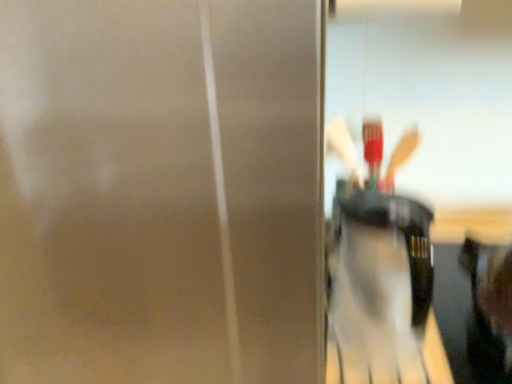
Question: From the image's perspective, would you say smooth black hair at right is shown under translucent plastic cup at center?

Choices:
 (A) yes
 (B) no

Answer: (B)

Question: Is smooth black hair at right closer to the viewer compared to translucent plastic cup at center?

Choices:
 (A) yes
 (B) no

Answer: (A)

Question: From a real-world perspective, is smooth black hair at right under translucent plastic cup at center?

Choices:
 (A) no
 (B) yes

Answer: (A)

Question: Is smooth black hair at right thinner than translucent plastic cup at center?

Choices:
 (A) no
 (B) yes

Answer: (A)

Question: Is smooth black hair at right oriented towards translucent plastic cup at center?

Choices:
 (A) no
 (B) yes

Answer: (A)

Question: Considering the relative sizes of smooth black hair at right and translucent plastic cup at center in the image provided, is smooth black hair at right shorter than translucent plastic cup at center?

Choices:
 (A) yes
 (B) no

Answer: (B)

Question: Can you confirm if translucent plastic cup at center is thinner than smooth black hair at right?

Choices:
 (A) no
 (B) yes

Answer: (B)

Question: From the image's perspective, is translucent plastic cup at center beneath smooth black hair at right?

Choices:
 (A) yes
 (B) no

Answer: (A)

Question: Is translucent plastic cup at center oriented away from smooth black hair at right?

Choices:
 (A) yes
 (B) no

Answer: (B)

Question: Is the position of translucent plastic cup at center more distant than that of smooth black hair at right?

Choices:
 (A) no
 (B) yes

Answer: (B)

Question: Does translucent plastic cup at center have a lesser height compared to smooth black hair at right?

Choices:
 (A) yes
 (B) no

Answer: (A)

Question: Is translucent plastic cup at center bigger than smooth black hair at right?

Choices:
 (A) yes
 (B) no

Answer: (B)

Question: Does matte silver screen door at center have a larger size compared to translucent plastic cup at center?

Choices:
 (A) yes
 (B) no

Answer: (A)